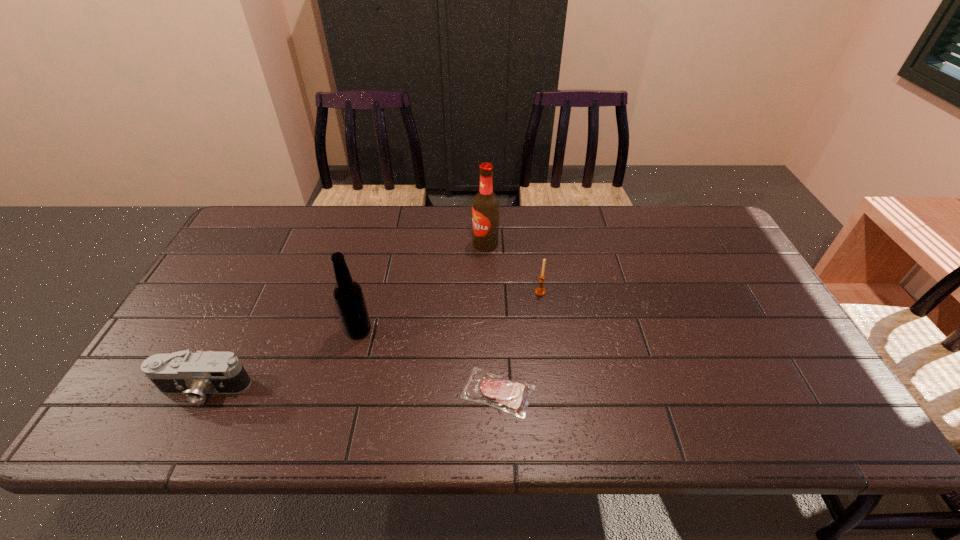
Locate an element on the screen. The width and height of the screenshot is (960, 540). blank area located 0.300m on the back of the nearer beer bottle is located at coordinates [379, 247].

Locate an element on the screen. This screenshot has width=960, height=540. vacant region located 0.360m on the left of the fourth nearest object is located at coordinates (408, 292).

Locate an element on the screen. The image size is (960, 540). vacant space situated 0.200m on the left of the steak is located at coordinates (373, 392).

Locate an element on the screen. The height and width of the screenshot is (540, 960). object that is at the far edge is located at coordinates (485, 206).

Locate an element on the screen. The image size is (960, 540). camera that is positioned at the near edge is located at coordinates (192, 375).

Locate an element on the screen. Image resolution: width=960 pixels, height=540 pixels. steak situated at the near edge is located at coordinates (511, 396).

Identify the location of object that is at the left edge. (192, 375).

At what (x,y) coordinates should I click in order to perform the action: click on object situated at the near left corner. Please return your answer as a coordinate pair (x, y). This screenshot has height=540, width=960. Looking at the image, I should click on (192, 375).

The height and width of the screenshot is (540, 960). I want to click on vacant space at the far edge of the desktop, so click(369, 227).

Find the location of a particular element. free point at the near edge is located at coordinates (424, 411).